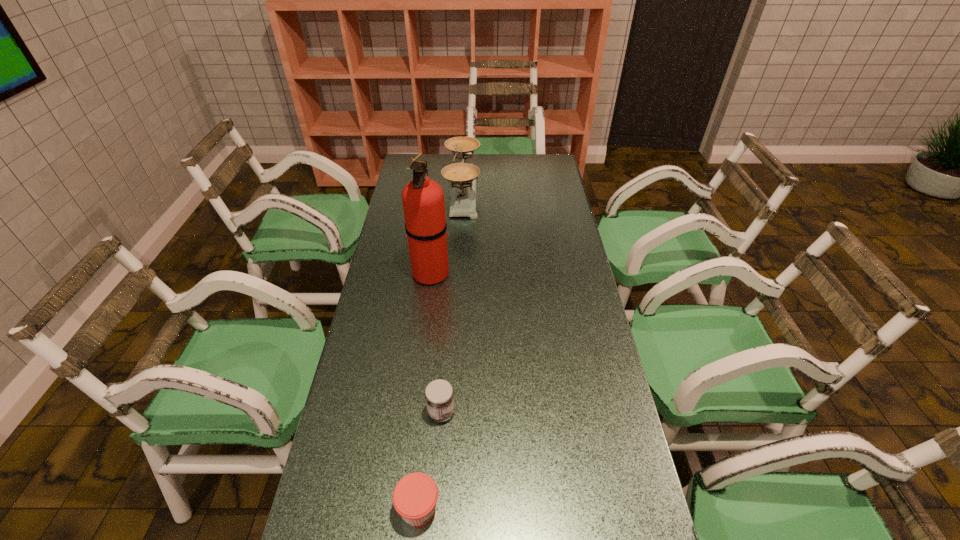
What are the coordinates of `the tallest object` in the screenshot? It's located at (423, 201).

You are a GUI agent. You are given a task and a screenshot of the screen. Output one action in this format:
    pyautogui.click(x=<x>, y=<y>)
    Task: Click on the fire extinguisher
    The image size is (960, 540).
    Given the screenshot: What is the action you would take?
    pyautogui.click(x=423, y=201)

The width and height of the screenshot is (960, 540). I want to click on scale, so click(462, 176).

Where is `the second tallest object`? Image resolution: width=960 pixels, height=540 pixels. the second tallest object is located at coordinates (462, 176).

Identify the location of the second shortest object. This screenshot has height=540, width=960. (439, 396).

The width and height of the screenshot is (960, 540). In order to click on the taller jam in this screenshot , I will do `click(439, 396)`.

Image resolution: width=960 pixels, height=540 pixels. I want to click on the shortest object, so click(415, 496).

Image resolution: width=960 pixels, height=540 pixels. I want to click on the nearer jam, so click(x=415, y=496).

Identify the location of vacant space located at the nozzle of the tallest object. The width and height of the screenshot is (960, 540). tap(464, 273).

The image size is (960, 540). Identify the location of free space located 0.240m on the front-facing side of the farthest object. (536, 194).